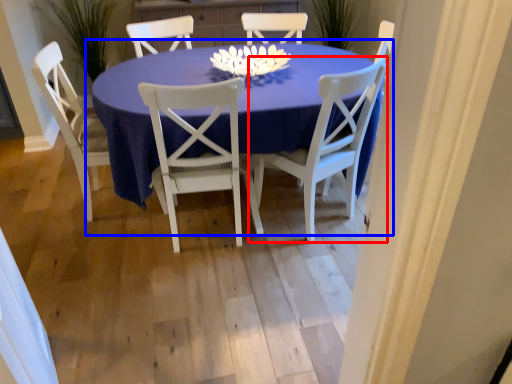
Question: Which of the following is the closest to the observer, chair (highlighted by a red box) or kitchen & dining room table (highlighted by a blue box)?

Choices:
 (A) chair
 (B) kitchen & dining room table

Answer: (B)